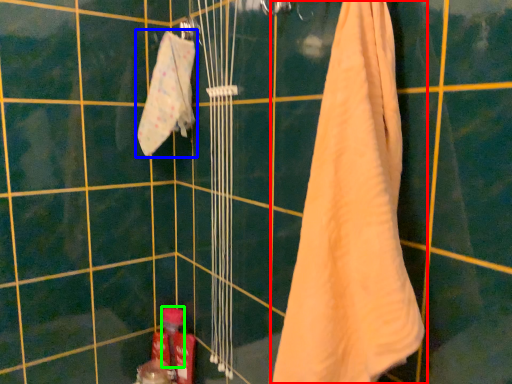
Question: Considering the real-world distances, which object is farthest from towel (highlighted by a red box)? towel (highlighted by a blue box) or toiletry (highlighted by a green box)?

Choices:
 (A) towel
 (B) toiletry

Answer: (B)